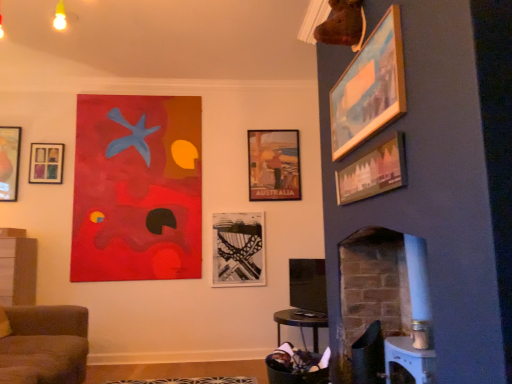
The height and width of the screenshot is (384, 512). What do you see at coordinates (46, 163) in the screenshot?
I see `matte glass picture frame at upper left, which ranks as the second picture frame in left-to-right order` at bounding box center [46, 163].

In order to face matte glass picture frame at upper left, which ranks as the second picture frame in left-to-right order, should I rotate leftwards or rightwards?

A 26.154 degree turn to the left will do.

Where is `matte wooden picture frame at upper right, positioned as the 2th picture frame in right-to-left order`? Image resolution: width=512 pixels, height=384 pixels. matte wooden picture frame at upper right, positioned as the 2th picture frame in right-to-left order is located at coordinates (373, 172).

At what (x,y) coordinates should I click in order to perform the action: click on black textured roller coaster at center, which appears as the 4th picture frame when viewed from the right. Please return your answer as a coordinate pair (x, y). Looking at the image, I should click on (238, 249).

Based on the photo, how much space does wooden picture frame at upper right, placed as the 6th picture frame when sorted from left to right, occupy vertically?

→ wooden picture frame at upper right, placed as the 6th picture frame when sorted from left to right, is 19.84 inches in height.

Measure the distance between point (x=63, y=336) and camera.

The depth of point (x=63, y=336) is 2.96 meters.

At what (x,y) coordinates should I click in order to perform the action: click on matte glass picture frame at upper left, the 4th picture frame positioned from the front. Please return your answer as a coordinate pair (x, y). The width and height of the screenshot is (512, 384). Looking at the image, I should click on (46, 163).

Can you confirm if metallic silver swivel chair at lower right is taller than white painted brick fireplace at right?

No.

Between metallic silver swivel chair at lower right and white painted brick fireplace at right, which one has smaller size?

With smaller size is metallic silver swivel chair at lower right.

Can you confirm if metallic silver swivel chair at lower right is positioned to the right of white painted brick fireplace at right?

No.

Is metallic silver swivel chair at lower right facing towards white painted brick fireplace at right?

No, metallic silver swivel chair at lower right is not oriented towards white painted brick fireplace at right.

Looking at this image, considering the relative sizes of matte paper poster at center, which appears as the sixth picture frame when viewed from the front, and matte black picture frame at upper left, the first picture frame viewed from the left, in the image provided, is matte paper poster at center, which appears as the sixth picture frame when viewed from the front, shorter than matte black picture frame at upper left, the first picture frame viewed from the left,?

In fact, matte paper poster at center, which appears as the sixth picture frame when viewed from the front, may be taller than matte black picture frame at upper left, the first picture frame viewed from the left.

Is matte paper poster at center, marked as the third picture frame in a right-to-left arrangement, situated inside matte black picture frame at upper left, the first picture frame viewed from the left, or outside?

matte paper poster at center, marked as the third picture frame in a right-to-left arrangement, cannot be found inside matte black picture frame at upper left, the first picture frame viewed from the left.

Is matte paper poster at center, positioned as the 4th picture frame in left-to-right order, not close to matte black picture frame at upper left, positioned as the 3th picture frame in front-to-back order?

Yes.

Is point (264, 195) less distant than point (4, 184)?

That is False.

Considering the relative sizes of white painted brick fireplace at right and matte paper poster at center, positioned as the 4th picture frame in left-to-right order, in the image provided, is white painted brick fireplace at right thinner than matte paper poster at center, positioned as the 4th picture frame in left-to-right order,?

Incorrect, the width of white painted brick fireplace at right is not less than that of matte paper poster at center, positioned as the 4th picture frame in left-to-right order.

Considering the positions of points (404, 260) and (248, 147), is point (404, 260) closer to camera compared to point (248, 147)?

That is True.

Where is `fireplace lying below the matte paper poster at center, which appears as the sixth picture frame when viewed from the front (from the image's perspective)`? fireplace lying below the matte paper poster at center, which appears as the sixth picture frame when viewed from the front (from the image's perspective) is located at coordinates (388, 299).

Could you measure the distance between white painted brick fireplace at right and matte paper poster at center, the 1th picture frame viewed from the back?

white painted brick fireplace at right is 1.80 meters from matte paper poster at center, the 1th picture frame viewed from the back.

Does brown fabric couch at lower left have a lesser width compared to matte glass picture frame at upper left, the 4th picture frame positioned from the front?

No, brown fabric couch at lower left is not thinner than matte glass picture frame at upper left, the 4th picture frame positioned from the front.

Would you say brown fabric couch at lower left contains matte glass picture frame at upper left, the 5th picture frame viewed from the right?

No, matte glass picture frame at upper left, the 5th picture frame viewed from the right, is not inside brown fabric couch at lower left.

You are a GUI agent. You are given a task and a screenshot of the screen. Output one action in this format:
    pyautogui.click(x=<x>, y=<y>)
    Task: Click on the furniture located on the right of matte glass picture frame at upper left, the 5th picture frame viewed from the right
    This screenshot has width=512, height=384.
    Given the screenshot: What is the action you would take?
    pyautogui.click(x=45, y=345)

Identify the location of furniture directly beneath the black textured roller coaster at center, the 5th picture frame in the front-to-back sequence (from a real-world perspective). This screenshot has width=512, height=384. tap(45, 345).

Is brown fabric couch at lower left in front of or behind black textured roller coaster at center, the second picture frame in the back-to-front sequence, in the image?

brown fabric couch at lower left is positioned closer to the viewer than black textured roller coaster at center, the second picture frame in the back-to-front sequence.

From a real-world perspective, is brown fabric couch at lower left below black textured roller coaster at center, the second picture frame in the back-to-front sequence?

Indeed, from a real-world perspective, brown fabric couch at lower left is positioned beneath black textured roller coaster at center, the second picture frame in the back-to-front sequence.

Which object is closer to the camera taking this photo, wooden picture frame at upper right, which appears as the second picture frame when viewed from the front, or matte black picture frame at upper left, the 4th picture frame positioned from the back?

wooden picture frame at upper right, which appears as the second picture frame when viewed from the front.

Is wooden picture frame at upper right, placed as the 6th picture frame when sorted from left to right, turned away from matte black picture frame at upper left, the first picture frame viewed from the left?

No, wooden picture frame at upper right, placed as the 6th picture frame when sorted from left to right, is not facing the opposite direction of matte black picture frame at upper left, the first picture frame viewed from the left.

From a real-world perspective, is wooden picture frame at upper right, which is counted as the first picture frame, starting from the right, located higher than matte black picture frame at upper left, positioned as the 3th picture frame in front-to-back order?

No, from a real-world perspective, wooden picture frame at upper right, which is counted as the first picture frame, starting from the right, is not above matte black picture frame at upper left, positioned as the 3th picture frame in front-to-back order.

From the image's perspective, which is above, wooden picture frame at upper right, which appears as the second picture frame when viewed from the front, or matte black picture frame at upper left, positioned as the 3th picture frame in front-to-back order?

wooden picture frame at upper right, which appears as the second picture frame when viewed from the front, from the image's perspective.

Which is more to the left, wooden picture frame at upper right, which appears as the second picture frame when viewed from the front, or matte wooden picture frame at upper right, the 6th picture frame when ordered from back to front?

matte wooden picture frame at upper right, the 6th picture frame when ordered from back to front, is more to the left.

In order to click on the 4th picture frame above when counting from the matte wooden picture frame at upper right, marked as the 5th picture frame in a left-to-right arrangement (from the image's perspective) in this screenshot , I will do `click(369, 87)`.

From a real-world perspective, is wooden picture frame at upper right, which appears as the second picture frame when viewed from the front, above or below matte wooden picture frame at upper right, marked as the 5th picture frame in a left-to-right arrangement?

wooden picture frame at upper right, which appears as the second picture frame when viewed from the front, is situated higher than matte wooden picture frame at upper right, marked as the 5th picture frame in a left-to-right arrangement, in the real world.

Does wooden picture frame at upper right, placed as the fifth picture frame when sorted from back to front, have a greater height compared to matte wooden picture frame at upper right, marked as the 5th picture frame in a left-to-right arrangement?

Correct, wooden picture frame at upper right, placed as the fifth picture frame when sorted from back to front, is much taller as matte wooden picture frame at upper right, marked as the 5th picture frame in a left-to-right arrangement.

The width and height of the screenshot is (512, 384). Find the location of `fireplace in front of the metallic silver swivel chair at lower right`. fireplace in front of the metallic silver swivel chair at lower right is located at coordinates (388, 299).

The image size is (512, 384). There is a matte black picture frame at upper left, the 4th picture frame positioned from the back. Find the location of `the 2nd picture frame below it (from a real-world perspective)`. the 2nd picture frame below it (from a real-world perspective) is located at coordinates (274, 165).

Based on their spatial positions, is brown fabric couch at lower left or matte paper poster at center, positioned as the 4th picture frame in left-to-right order, closer to white painted brick fireplace at right?

matte paper poster at center, positioned as the 4th picture frame in left-to-right order, lies closer to white painted brick fireplace at right than the other object.

Considering their positions, is metallic silver swivel chair at lower right positioned further to matte glass picture frame at upper left, which is the 3th picture frame from back to front, than black textured roller coaster at center, the second picture frame in the back-to-front sequence?

The object further to matte glass picture frame at upper left, which is the 3th picture frame from back to front, is metallic silver swivel chair at lower right.

Which object lies further to the anchor point matte black picture frame at upper left, the first picture frame viewed from the left, metallic silver swivel chair at lower right or black textured roller coaster at center, which is the third picture frame in left-to-right order?

The object further to matte black picture frame at upper left, the first picture frame viewed from the left, is metallic silver swivel chair at lower right.

Based on their spatial positions, is brown fabric couch at lower left or metallic silver swivel chair at lower right closer to matte black picture frame at upper left, the 4th picture frame positioned from the back?

Based on the image, brown fabric couch at lower left appears to be nearer to matte black picture frame at upper left, the 4th picture frame positioned from the back.

From the image, which object appears to be farther from matte glass picture frame at upper left, which ranks as the second picture frame in left-to-right order, brown fabric couch at lower left or white painted brick fireplace at right?

The object further to matte glass picture frame at upper left, which ranks as the second picture frame in left-to-right order, is white painted brick fireplace at right.

Looking at the image, which one is located further to brown fabric couch at lower left, matte paper poster at center, which appears as the sixth picture frame when viewed from the front, or matte black picture frame at upper left, placed as the sixth picture frame when sorted from right to left?

matte paper poster at center, which appears as the sixth picture frame when viewed from the front, lies further to brown fabric couch at lower left than the other object.

Estimate the real-world distances between objects in this image. Which object is closer to matte paper poster at center, positioned as the 4th picture frame in left-to-right order, matte glass picture frame at upper left, the 5th picture frame viewed from the right, or black textured roller coaster at center, which appears as the 4th picture frame when viewed from the right?

black textured roller coaster at center, which appears as the 4th picture frame when viewed from the right, is closer to matte paper poster at center, positioned as the 4th picture frame in left-to-right order.

Estimate the real-world distances between objects in this image. Which object is further from black textured roller coaster at center, which appears as the 4th picture frame when viewed from the right, matte glass picture frame at upper left, which is the 3th picture frame from back to front, or brown fabric couch at lower left?

The object further to black textured roller coaster at center, which appears as the 4th picture frame when viewed from the right, is matte glass picture frame at upper left, which is the 3th picture frame from back to front.

Find the location of a particular element. The image size is (512, 384). swivel chair situated between brown fabric couch at lower left and white painted brick fireplace at right from left to right is located at coordinates (369, 356).

This screenshot has width=512, height=384. Identify the location of picture frame located between matte black picture frame at upper left, the first picture frame viewed from the left, and black textured roller coaster at center, the second picture frame in the back-to-front sequence, in the left-right direction. (46, 163).

Image resolution: width=512 pixels, height=384 pixels. I want to click on swivel chair between matte wooden picture frame at upper right, the 1th picture frame in the front-to-back sequence, and matte paper poster at center, which appears as the sixth picture frame when viewed from the front, from front to back, so click(369, 356).

This screenshot has width=512, height=384. Find the location of `swivel chair positioned between wooden picture frame at upper right, placed as the 6th picture frame when sorted from left to right, and matte paper poster at center, the 1th picture frame viewed from the back, from near to far`. swivel chair positioned between wooden picture frame at upper right, placed as the 6th picture frame when sorted from left to right, and matte paper poster at center, the 1th picture frame viewed from the back, from near to far is located at coordinates click(369, 356).